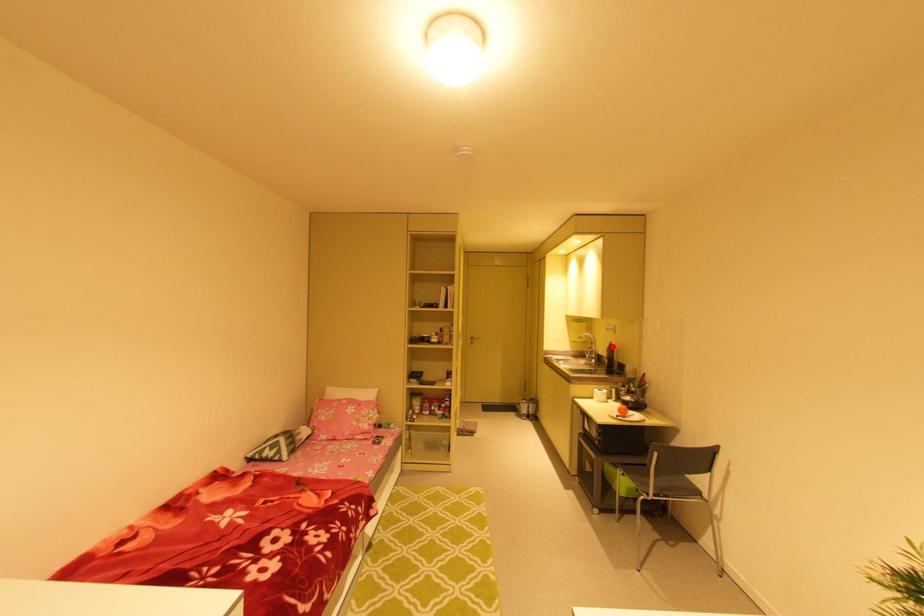
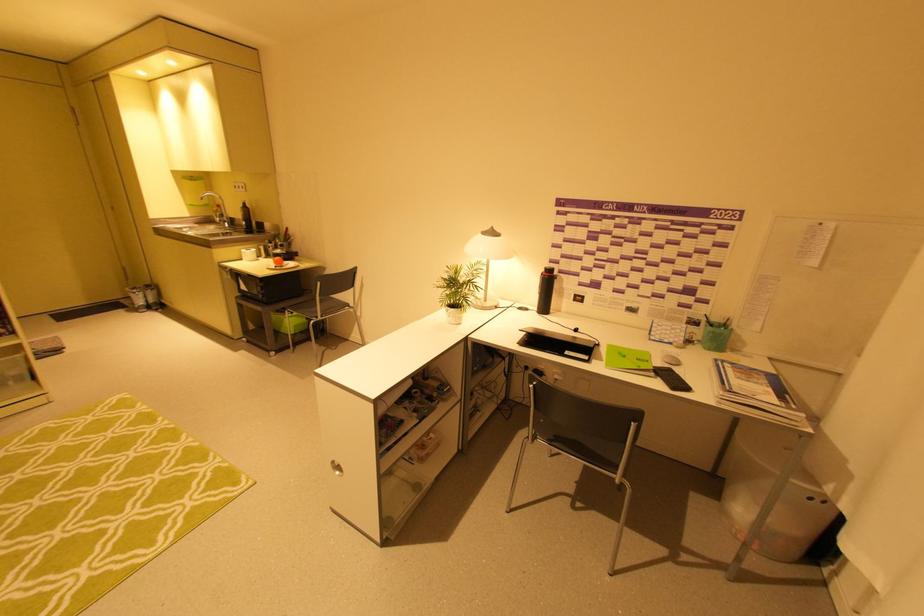
Question: I am providing you with two images of the same scene from different viewpoints. In image1, a red point is highlighted. Considering the same 3D point in image2, which of the following is correct?

Choices:
 (A) It is closer
 (B) It is farther

Answer: (A)